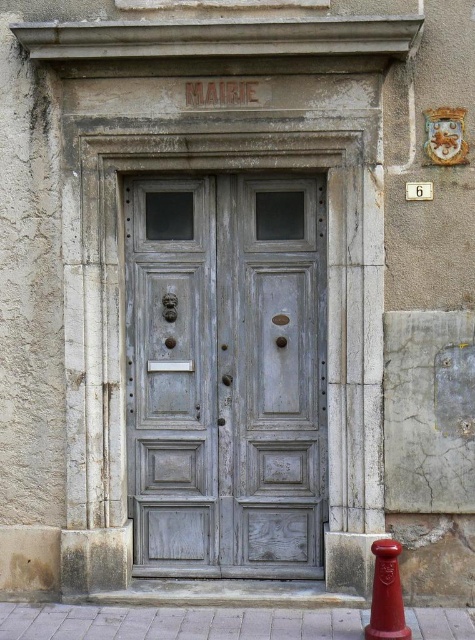
You are standing in front of the weathered wood door at center and the shiny red traffic cone at lower right. Which object is closer to you?

The weathered wood door at center is closer to you because it is further to the viewer than the shiny red traffic cone at lower right.